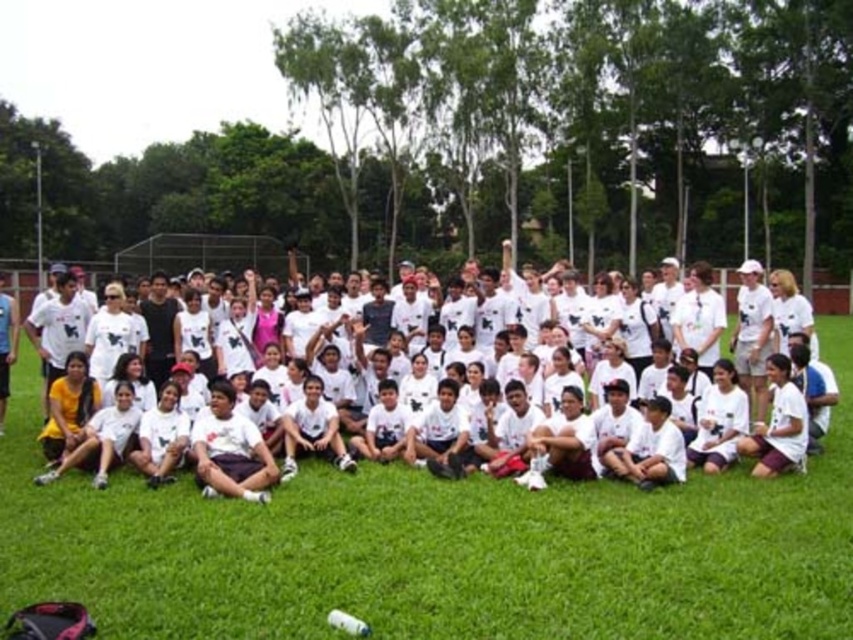
Is point (807, 576) positioned before point (10, 316)?

That is True.

Does green grass at center have a larger size compared to white cotton shirt at lower left?

No.

Is point (64, 556) farther from camera compared to point (16, 316)?

No, (64, 556) is in front of (16, 316).

Find the location of `green grass at center`. green grass at center is located at coordinates (440, 548).

Is white cotton t-shirt at center further to camera compared to white cotton shirt at lower left?

No, white cotton t-shirt at center is in front of white cotton shirt at lower left.

Find the location of `white cotton t-shirt at center`. white cotton t-shirt at center is located at coordinates (78, 326).

Does point (292, 344) lie behind point (6, 376)?

Yes, point (292, 344) is farther from viewer.

At what (x,y) coordinates should I click in order to perform the action: click on white cotton t-shirt at center. Please return your answer as a coordinate pair (x, y). The width and height of the screenshot is (853, 640). Looking at the image, I should click on (78, 326).

Which of these two, green grass at center or white cotton t-shirt at center, stands shorter?

green grass at center

The height and width of the screenshot is (640, 853). What do you see at coordinates (440, 548) in the screenshot?
I see `green grass at center` at bounding box center [440, 548].

Find the location of a particular element. Image resolution: width=853 pixels, height=640 pixels. green grass at center is located at coordinates (440, 548).